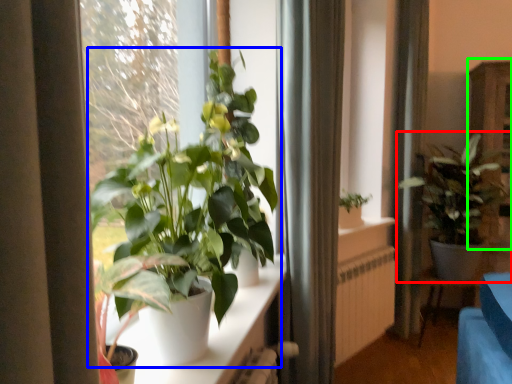
Question: Considering the real-world distances, which object is farthest from houseplant (highlighted by a red box)? houseplant (highlighted by a blue box) or dresser (highlighted by a green box)?

Choices:
 (A) houseplant
 (B) dresser

Answer: (A)